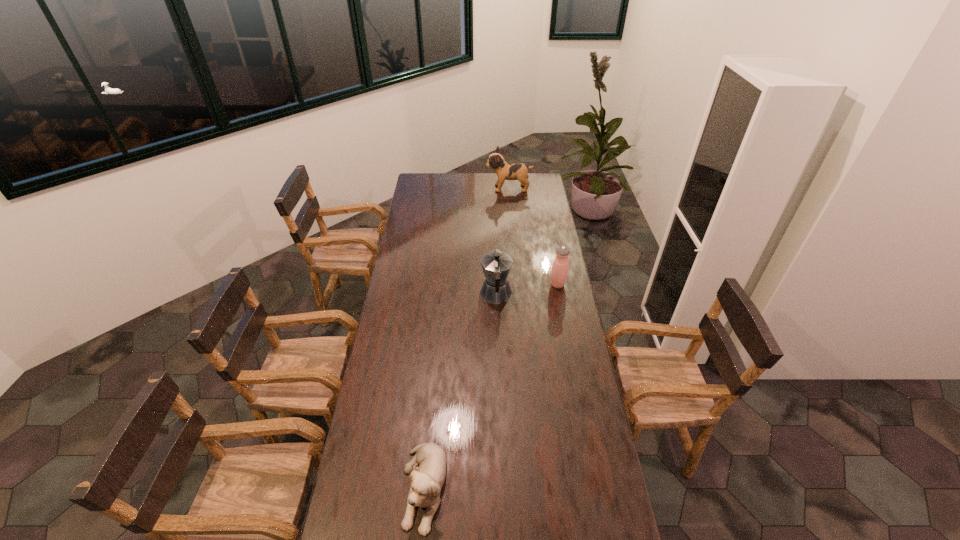
Find the location of a particular element. The width and height of the screenshot is (960, 540). the taller puppy is located at coordinates (505, 171).

You are a GUI agent. You are given a task and a screenshot of the screen. Output one action in this format:
    pyautogui.click(x=<x>, y=<y>)
    Task: Click on the right puppy
    The image size is (960, 540).
    Given the screenshot: What is the action you would take?
    pyautogui.click(x=505, y=171)

This screenshot has width=960, height=540. I want to click on coffeepot, so 496,265.

Find the location of a particular element. the rightmost object is located at coordinates (560, 268).

What are the coordinates of `the nearer puppy` in the screenshot? It's located at (426, 480).

The width and height of the screenshot is (960, 540). I want to click on the shortest object, so click(426, 480).

Identify the location of free space located at the face of the right puppy. (451, 188).

This screenshot has height=540, width=960. In order to click on vacant region located at the face of the right puppy in this screenshot , I will do `click(430, 188)`.

Locate an element on the screen. blank area located 0.100m at the face of the right puppy is located at coordinates (470, 188).

Locate an element on the screen. This screenshot has height=540, width=960. vacant space located 0.390m at the spout of the coffeepot is located at coordinates (493, 233).